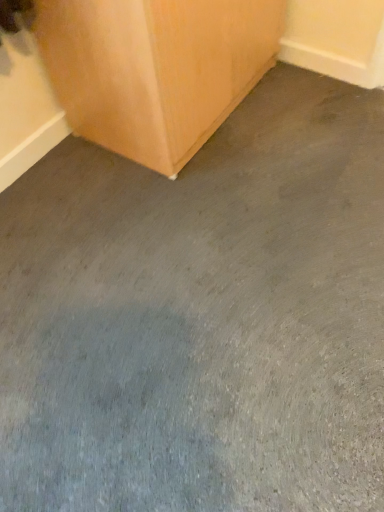
Where is `free spot to the right of light brown wood cabinet at upper left`? The height and width of the screenshot is (512, 384). free spot to the right of light brown wood cabinet at upper left is located at coordinates (311, 113).